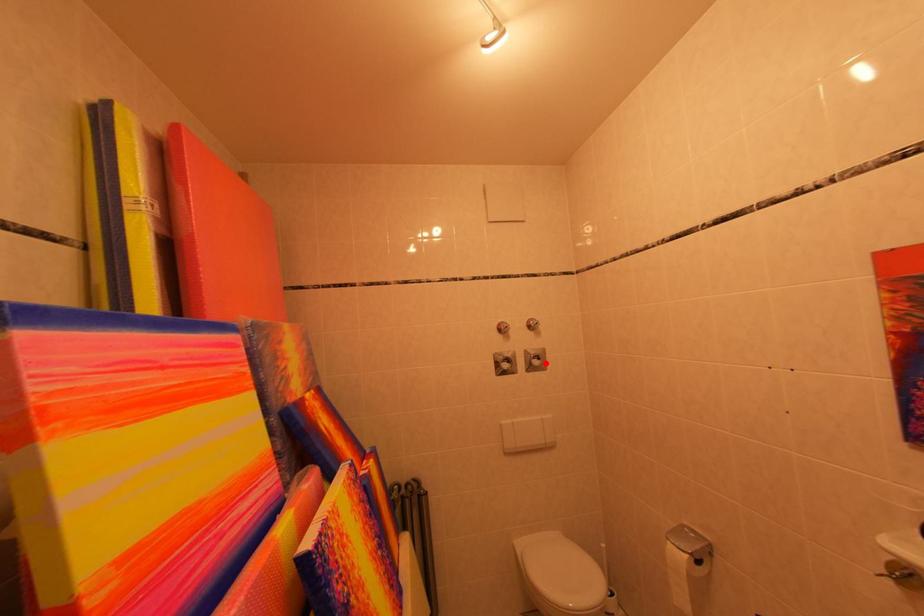
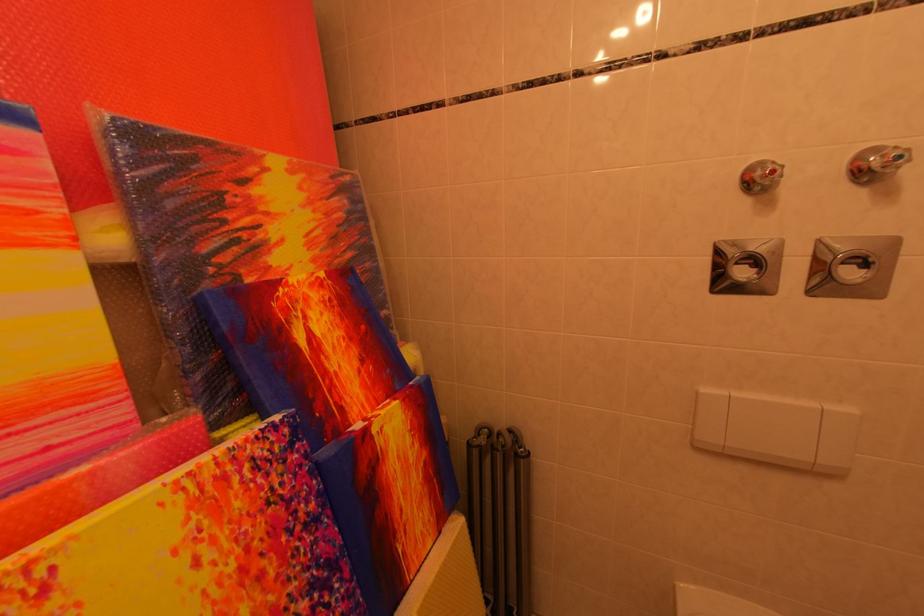
Locate, in the second image, the point that corresponds to the highlighted location in the first image.

(864, 270)